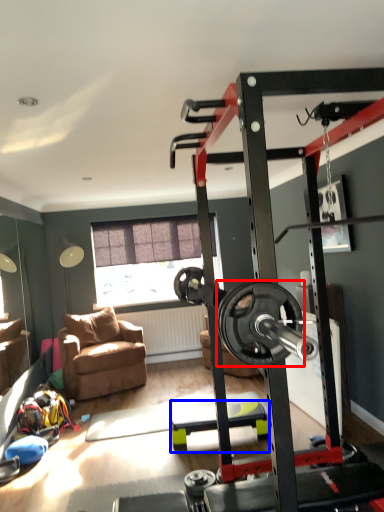
Question: Which of the following is the closest to the observer, wheel (highlighted by a red box) or furniture (highlighted by a blue box)?

Choices:
 (A) wheel
 (B) furniture

Answer: (B)